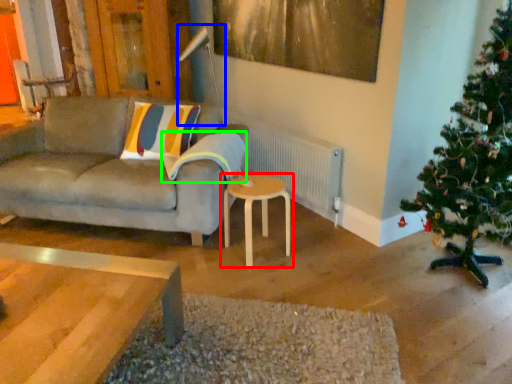
Question: Estimate the real-world distances between objects in this image. Which object is farther from table (highlighted by a red box), lamp (highlighted by a blue box) or pillow (highlighted by a green box)?

Choices:
 (A) lamp
 (B) pillow

Answer: (A)